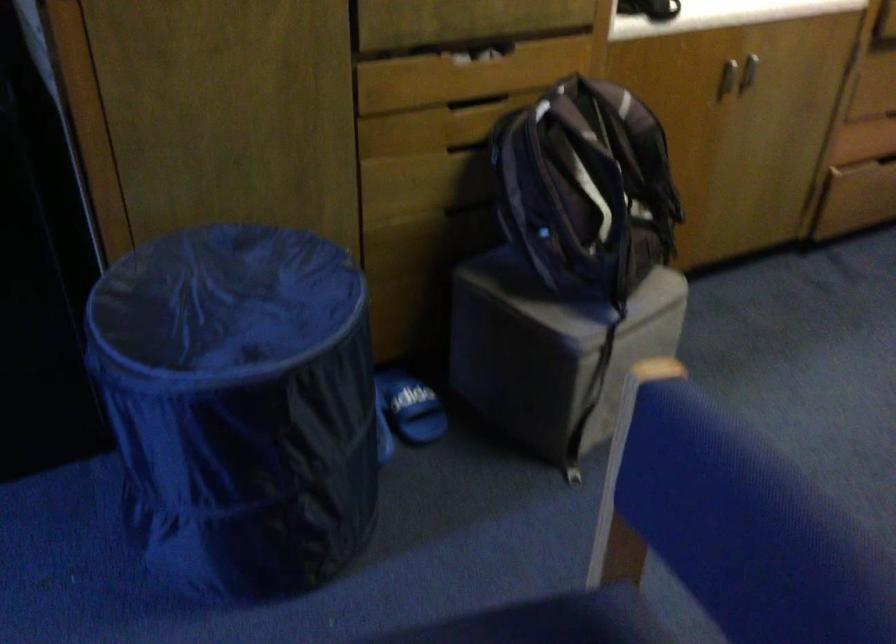
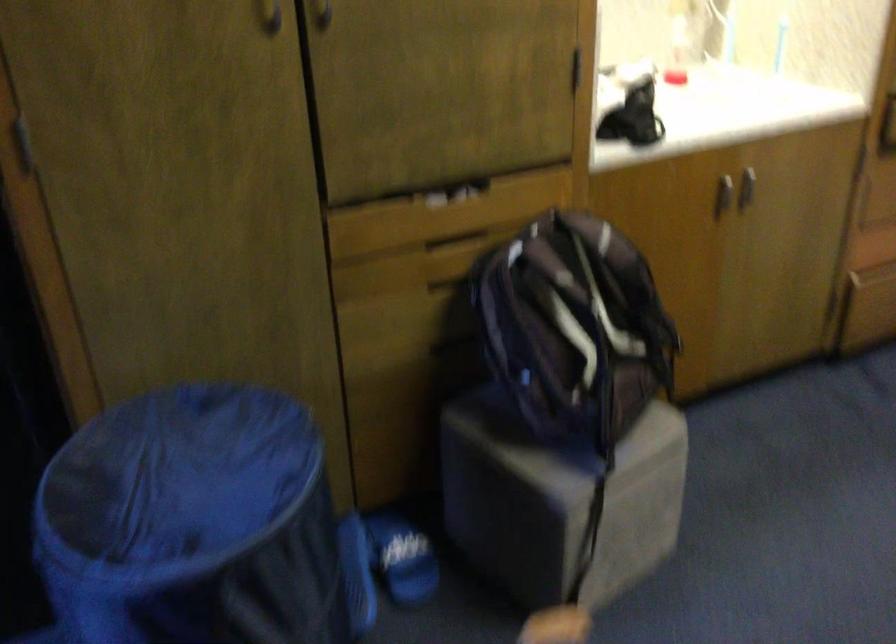
Find the pixel in the second image that matches pixel 478 98 in the first image.

(455, 242)